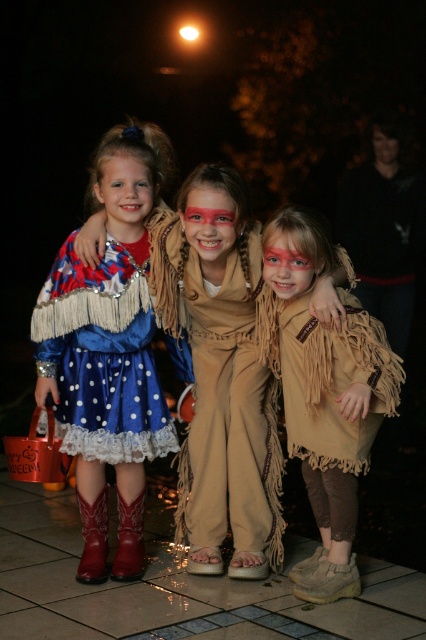
Is tan suede fringe cape at center below matte tan face at center?

Indeed, tan suede fringe cape at center is positioned under matte tan face at center.

Can you confirm if tan suede fringe cape at center is taller than matte tan face at center?

Indeed, tan suede fringe cape at center has a greater height compared to matte tan face at center.

Does point (305, 442) lie behind point (221, 211)?

Yes.

Identify the location of tan suede fringe cape at center. The height and width of the screenshot is (640, 426). (324, 394).

Does matte blue dress at left have a greater height compared to blue sequined dress at left?

Correct, matte blue dress at left is much taller as blue sequined dress at left.

Does matte blue dress at left have a lesser width compared to blue sequined dress at left?

Correct, matte blue dress at left's width is less than blue sequined dress at left's.

This screenshot has height=640, width=426. What are the coordinates of `matte blue dress at left` in the screenshot? It's located at (104, 378).

Between tan suede fringe cape at center and red leather boot at lower left, which one appears on the right side from the viewer's perspective?

tan suede fringe cape at center

Can you confirm if tan suede fringe cape at center is positioned below red leather boot at lower left?

No, tan suede fringe cape at center is not below red leather boot at lower left.

Does point (394, 387) come in front of point (86, 572)?

That is True.

At what (x,y) coordinates should I click in order to perform the action: click on tan suede fringe cape at center. Please return your answer as a coordinate pair (x, y). Looking at the image, I should click on [324, 394].